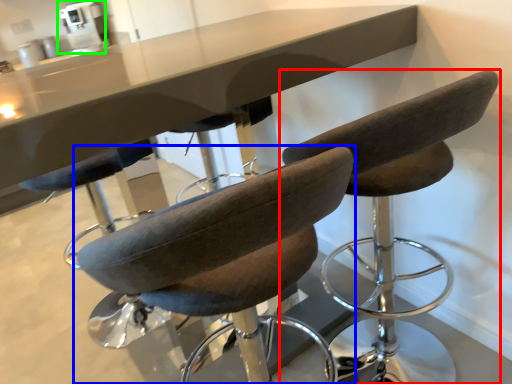
Question: Estimate the real-world distances between objects in this image. Which object is closer to chair (highlighted by a red box), chair (highlighted by a blue box) or coffee machine (highlighted by a green box)?

Choices:
 (A) chair
 (B) coffee machine

Answer: (A)